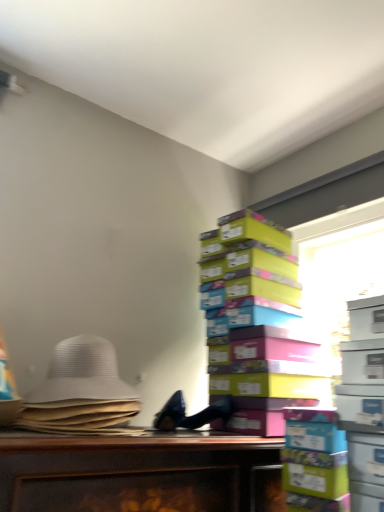
Question: Is white fabric hat at left bigger than transparent plastic window screen at upper right?

Choices:
 (A) yes
 (B) no

Answer: (B)

Question: Is white fabric hat at left to the left of transparent plastic window screen at upper right from the viewer's perspective?

Choices:
 (A) yes
 (B) no

Answer: (A)

Question: Is white fabric hat at left positioned before transparent plastic window screen at upper right?

Choices:
 (A) yes
 (B) no

Answer: (A)

Question: From a real-world perspective, is white fabric hat at left on top of transparent plastic window screen at upper right?

Choices:
 (A) no
 (B) yes

Answer: (A)

Question: Is white fabric hat at left located outside transparent plastic window screen at upper right?

Choices:
 (A) no
 (B) yes

Answer: (B)

Question: Does white fabric hat at left contain transparent plastic window screen at upper right?

Choices:
 (A) no
 (B) yes

Answer: (A)

Question: Are white fabric hat at left and multicolored cardboard boxes at right making contact?

Choices:
 (A) no
 (B) yes

Answer: (A)

Question: Is white fabric hat at left positioned before multicolored cardboard boxes at right?

Choices:
 (A) yes
 (B) no

Answer: (A)

Question: Is there a large distance between white fabric hat at left and multicolored cardboard boxes at right?

Choices:
 (A) no
 (B) yes

Answer: (A)

Question: From the image's perspective, is white fabric hat at left over multicolored cardboard boxes at right?

Choices:
 (A) yes
 (B) no

Answer: (B)

Question: Is white fabric hat at left facing towards multicolored cardboard boxes at right?

Choices:
 (A) no
 (B) yes

Answer: (A)

Question: Does white fabric hat at left have a larger size compared to multicolored cardboard boxes at right?

Choices:
 (A) no
 (B) yes

Answer: (A)

Question: Considering the relative sizes of transparent plastic window screen at upper right and white fabric hat at left in the image provided, is transparent plastic window screen at upper right thinner than white fabric hat at left?

Choices:
 (A) no
 (B) yes

Answer: (B)